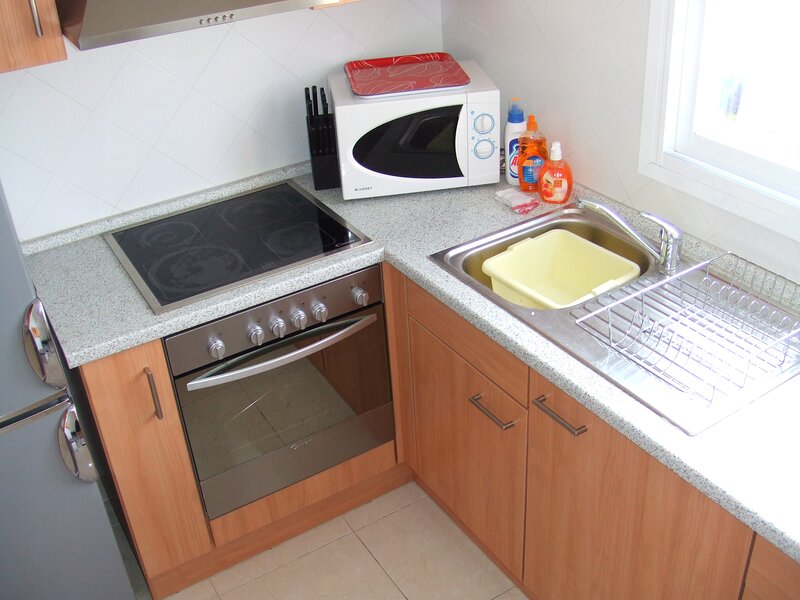
Point to any where to open cabinet small door in the image. Your answer should be formatted as a list of tuples, i.e. [(x1, y1), (x2, y2), ...], where each tuple contains the x and y coordinates of a point satisfying the conditions above.

[(156, 397)]